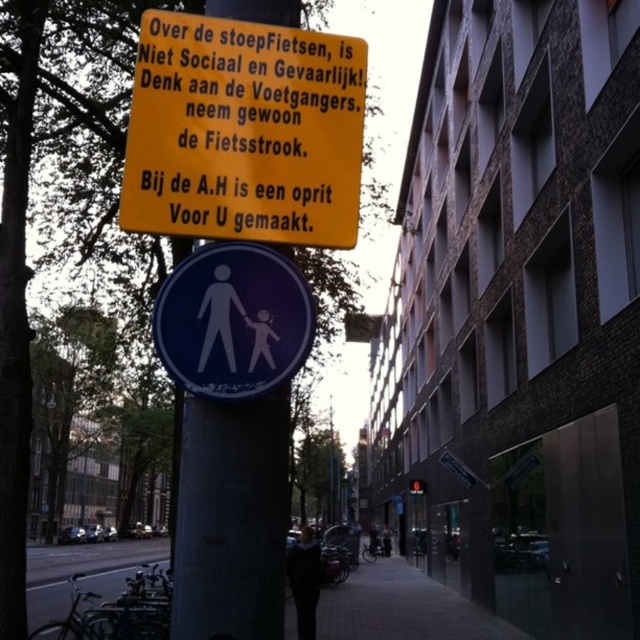
Who is higher up, smooth gray pole at center or matte black pedestrian at center?

smooth gray pole at center is higher up.

Between point (211, 428) and point (369, 536), which one is positioned behind?

Point (369, 536)

At what (x,y) coordinates should I click in order to perform the action: click on smooth gray pole at center. Please return your answer as a coordinate pair (x, y). This screenshot has height=640, width=640. Looking at the image, I should click on (230, 518).

Who is more forward, (202, 500) or (276, 342)?

Point (202, 500) is in front.

Between smooth gray pole at center and blue glossy pedestrian sign at center, which one has less height?

blue glossy pedestrian sign at center is shorter.

This screenshot has width=640, height=640. What do you see at coordinates (230, 518) in the screenshot? I see `smooth gray pole at center` at bounding box center [230, 518].

I want to click on smooth gray pole at center, so click(x=230, y=518).

Does paved sidewalk at center have a greater height compared to matte black pedestrian at center?

Yes.

Between point (108, 548) and point (371, 554), which one is positioned in front?

Positioned in front is point (371, 554).

The image size is (640, 640). What are the coordinates of `paved sidewalk at center` in the screenshot? It's located at (403, 609).